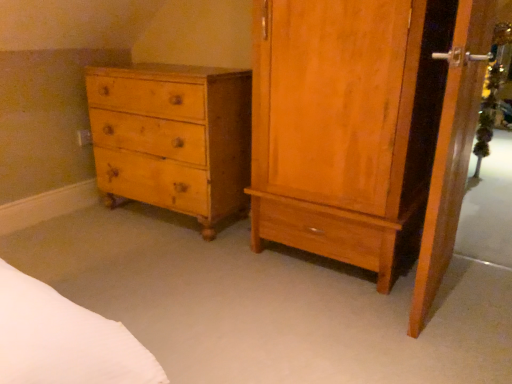
In order to face light brown wood cabinet at right, should I rotate leftwards or rightwards?

Rotate your view right by about 11.637°.

Where is `wooden screen door at right`? Image resolution: width=512 pixels, height=384 pixels. wooden screen door at right is located at coordinates (452, 151).

From a real-world perspective, is light brown wood cabinet at right physically above yellow wood chest of drawers at left?

Yes, from a real-world perspective, light brown wood cabinet at right is on top of yellow wood chest of drawers at left.

Between light brown wood cabinet at right and yellow wood chest of drawers at left, which one has smaller size?

yellow wood chest of drawers at left.

Which is behind, light brown wood cabinet at right or yellow wood chest of drawers at left?

Positioned behind is yellow wood chest of drawers at left.

Is yellow wood chest of drawers at left spatially inside wooden screen door at right, or outside of it?

yellow wood chest of drawers at left lies outside wooden screen door at right.

Is there a large distance between yellow wood chest of drawers at left and wooden screen door at right?

Yes, yellow wood chest of drawers at left and wooden screen door at right are located far from each other.

What's the angular difference between yellow wood chest of drawers at left and wooden screen door at right's facing directions?

A: yellow wood chest of drawers at left and wooden screen door at right are facing 91.3 degrees away from each other.

Is the position of yellow wood chest of drawers at left less distant than that of wooden screen door at right?

No, yellow wood chest of drawers at left is behind wooden screen door at right.

From the image's perspective, is wooden screen door at right above or below yellow wood chest of drawers at left?

wooden screen door at right is below yellow wood chest of drawers at left.

Where is `screen door on the right of the yellow wood chest of drawers at left`? screen door on the right of the yellow wood chest of drawers at left is located at coordinates (452, 151).

Is wooden screen door at right looking in the opposite direction of yellow wood chest of drawers at left?

Yes, wooden screen door at right is positioned with its back facing yellow wood chest of drawers at left.

Is wooden screen door at right directly adjacent to yellow wood chest of drawers at left?

No, wooden screen door at right is not making contact with yellow wood chest of drawers at left.

Is light brown wood cabinet at right facing towards wooden screen door at right?

No.

Considering the sizes of objects light brown wood cabinet at right and wooden screen door at right in the image provided, who is wider, light brown wood cabinet at right or wooden screen door at right?

light brown wood cabinet at right is wider.

Is light brown wood cabinet at right bigger or smaller than wooden screen door at right?

In the image, light brown wood cabinet at right appears to be larger than wooden screen door at right.

The image size is (512, 384). I want to click on screen door on the right of light brown wood cabinet at right, so click(x=452, y=151).

Does point (460, 69) come in front of point (346, 38)?

Yes, it is in front of point (346, 38).

From the image's perspective, between wooden screen door at right and light brown wood cabinet at right, who is located below?

From the image's view, wooden screen door at right is below.

Is wooden screen door at right with light brown wood cabinet at right?

wooden screen door at right and light brown wood cabinet at right are not in contact.

Is wooden screen door at right aimed at light brown wood cabinet at right?

Yes, wooden screen door at right is aimed at light brown wood cabinet at right.

Does yellow wood chest of drawers at left turn towards light brown wood cabinet at right?

No, yellow wood chest of drawers at left is not oriented towards light brown wood cabinet at right.

Can you confirm if yellow wood chest of drawers at left is positioned to the left of light brown wood cabinet at right?

Indeed, yellow wood chest of drawers at left is positioned on the left side of light brown wood cabinet at right.

From the image's perspective, between yellow wood chest of drawers at left and light brown wood cabinet at right, who is located below?

light brown wood cabinet at right appears lower in the image.

Identify the location of nightstand lying on the right of yellow wood chest of drawers at left. (365, 129).

Image resolution: width=512 pixels, height=384 pixels. I want to click on the chest of drawers that is under the wooden screen door at right (from a real-world perspective), so click(172, 137).

When comparing their distances from light brown wood cabinet at right, does yellow wood chest of drawers at left or wooden screen door at right seem closer?

Based on the image, wooden screen door at right appears to be nearer to light brown wood cabinet at right.

Which object lies nearer to the anchor point wooden screen door at right, light brown wood cabinet at right or yellow wood chest of drawers at left?

light brown wood cabinet at right lies closer to wooden screen door at right than the other object.

Looking at the image, which one is located further to wooden screen door at right, yellow wood chest of drawers at left or light brown wood cabinet at right?

yellow wood chest of drawers at left lies further to wooden screen door at right than the other object.

From the image, which object appears to be nearer to light brown wood cabinet at right, wooden screen door at right or yellow wood chest of drawers at left?

Based on the image, wooden screen door at right appears to be nearer to light brown wood cabinet at right.

Looking at the image, which one is located further to yellow wood chest of drawers at left, light brown wood cabinet at right or wooden screen door at right?

Based on the image, wooden screen door at right appears to be further to yellow wood chest of drawers at left.

Based on their spatial positions, is wooden screen door at right or light brown wood cabinet at right further from yellow wood chest of drawers at left?

Among the two, wooden screen door at right is located further to yellow wood chest of drawers at left.

The height and width of the screenshot is (384, 512). I want to click on nightstand located between yellow wood chest of drawers at left and wooden screen door at right in the left-right direction, so click(365, 129).